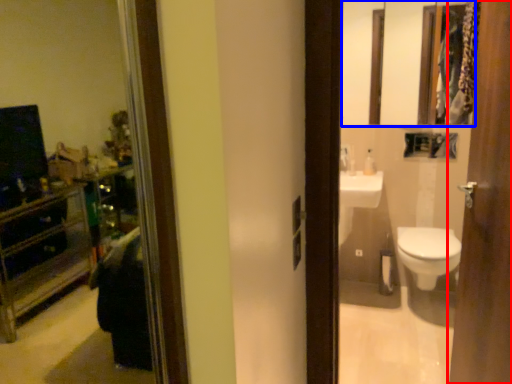
Question: Which object is further to the camera taking this photo, door (highlighted by a red box) or mirror (highlighted by a blue box)?

Choices:
 (A) door
 (B) mirror

Answer: (B)